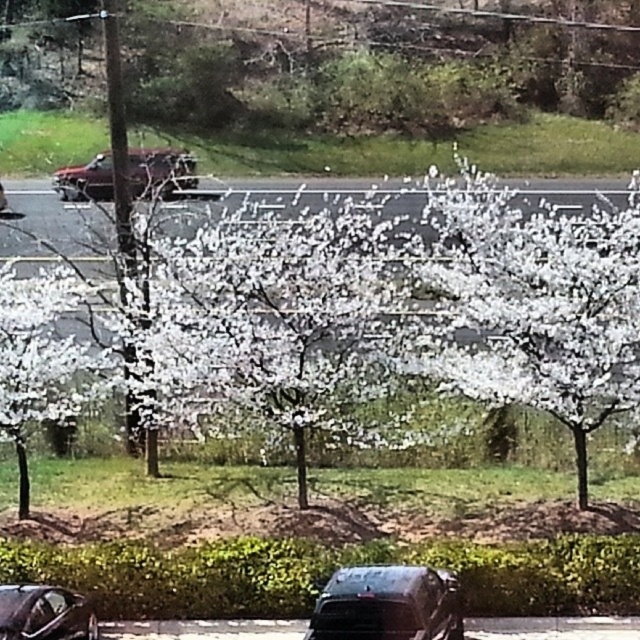
Question: Which of the following is the closest to the observer?

Choices:
 (A) shiny black car at lower left
 (B) dark gray metallic car at lower center
 (C) metallic maroon suv at center
 (D) white matte tree at center

Answer: (B)

Question: Which object appears closest to the camera in this image?

Choices:
 (A) shiny black car at lower left
 (B) white matte tree at center

Answer: (A)

Question: Does white matte tree at center have a lesser width compared to dark gray metallic car at lower center?

Choices:
 (A) no
 (B) yes

Answer: (A)

Question: Can you confirm if white matte tree at center is positioned to the left of metallic maroon suv at center?

Choices:
 (A) yes
 (B) no

Answer: (B)

Question: Which of the following is the closest to the observer?

Choices:
 (A) white matte tree at center
 (B) dark gray metallic car at lower center
 (C) metallic maroon suv at center
 (D) shiny black car at lower left

Answer: (B)

Question: Considering the relative positions of white matte tree at center and metallic maroon suv at center in the image provided, where is white matte tree at center located with respect to metallic maroon suv at center?

Choices:
 (A) right
 (B) left

Answer: (A)